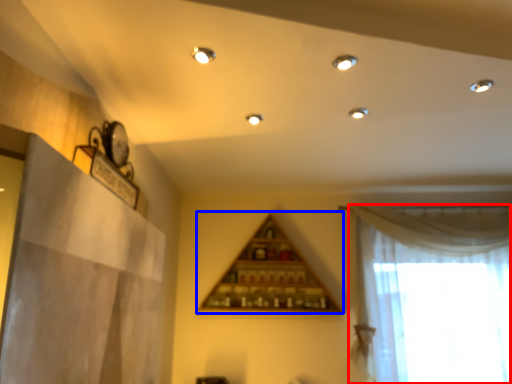
Question: Which object is closer to the camera taking this photo, curtain (highlighted by a red box) or shelf (highlighted by a blue box)?

Choices:
 (A) curtain
 (B) shelf

Answer: (A)